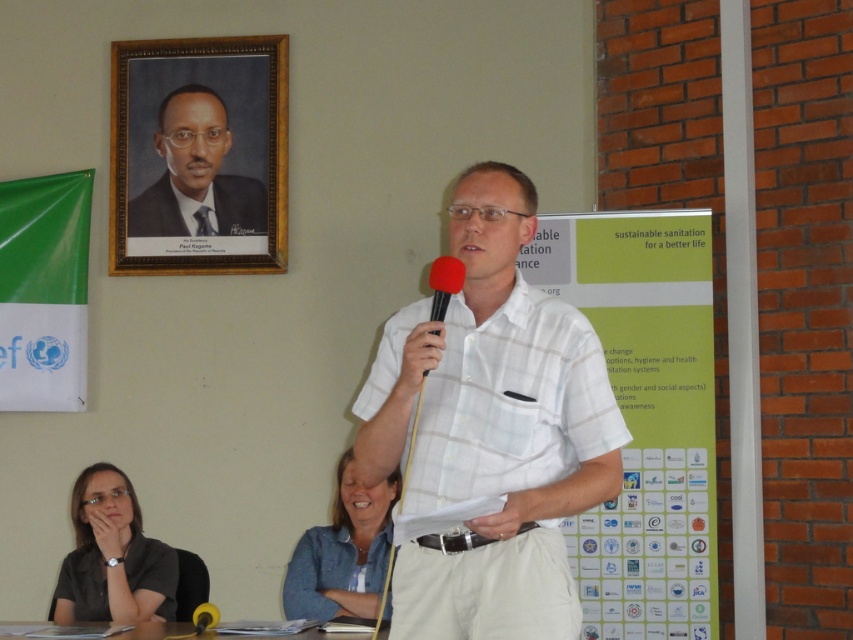
You are an event planner arranging the stage for a speech. You need to ensure that the matte red microphone at center is visible to the audience. Given that the matte black shirt at lower left is currently blocking its view, what adjustment should you make?

The matte red microphone at center is behind the matte black shirt at lower left, so to make the microphone visible, you should move the matte black shirt at lower left out of the way or position the microphone in front of it.

You are an event planner setting up a stage. You need to ensure that the formal black suit at upper left and the matte red microphone at center are visible to the audience. Which object should be placed closer to the front of the stage to ensure visibility?

The formal black suit at upper left should be placed closer to the front of the stage because it is already positioned further to the viewer than the matte red microphone at center, meaning it is closer to the audience and would remain visible.